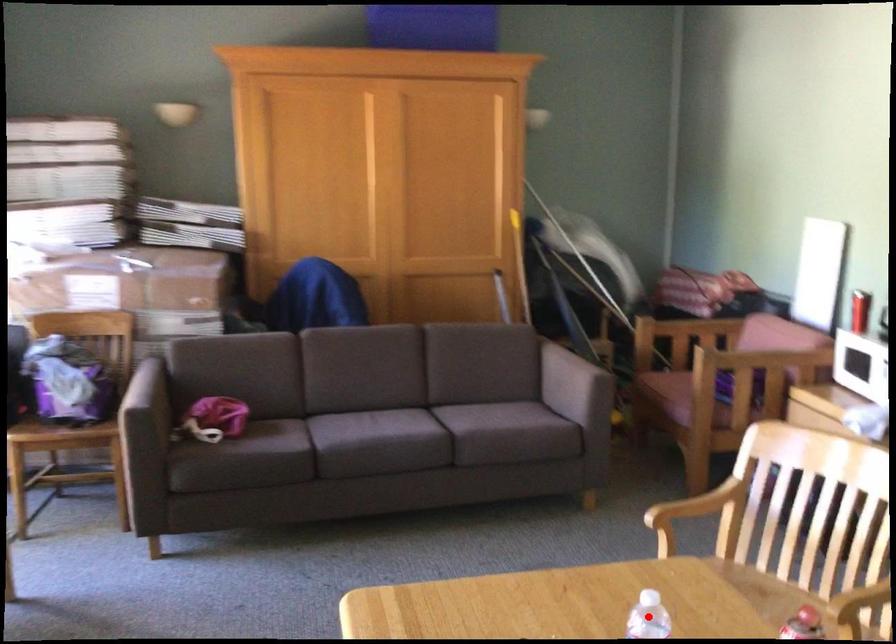
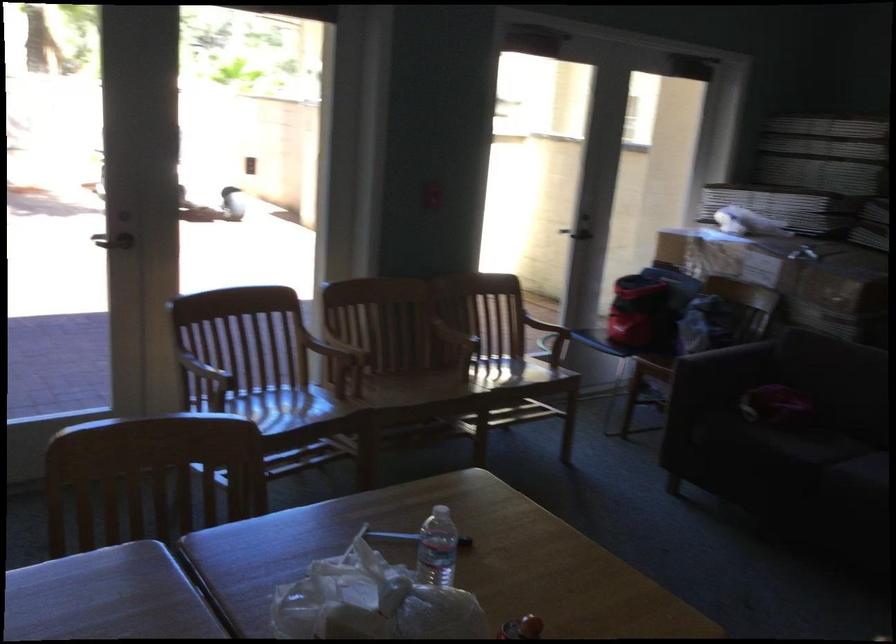
Question: I am providing you with two images of the same scene from different viewpoints. A red point is marked on the first image. At the location where the point appears in image 1, is it still visible in image 2?

Choices:
 (A) Yes
 (B) No

Answer: (B)